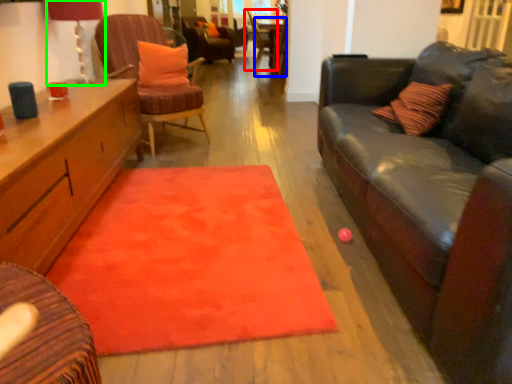
Question: Considering the real-world distances, which object is closest to chair (highlighted by a red box)? table (highlighted by a blue box) or lamp (highlighted by a green box).

Choices:
 (A) table
 (B) lamp

Answer: (A)